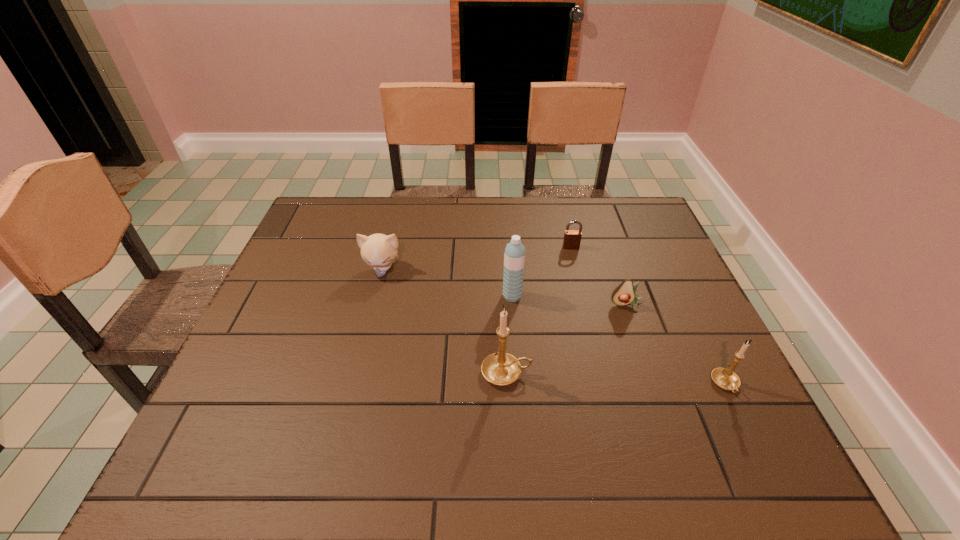
Where is `the taller candle holder`? Image resolution: width=960 pixels, height=540 pixels. the taller candle holder is located at coordinates (500, 368).

You are a GUI agent. You are given a task and a screenshot of the screen. Output one action in this format:
    pyautogui.click(x=<x>, y=<y>)
    Task: Click on the rightmost object
    This screenshot has height=540, width=960.
    Given the screenshot: What is the action you would take?
    pyautogui.click(x=725, y=378)

In order to click on the right candle holder in this screenshot , I will do `click(725, 378)`.

Locate an element on the screen. The height and width of the screenshot is (540, 960). the second farthest object is located at coordinates 378,250.

The width and height of the screenshot is (960, 540). Find the location of `kitten`. kitten is located at coordinates (378, 250).

Identify the location of padlock. coord(572,238).

In order to click on the third object from right to left in this screenshot , I will do `click(572, 238)`.

The image size is (960, 540). Identify the location of the second object from right to left. (624, 294).

Identify the location of water bottle. This screenshot has height=540, width=960. (514, 256).

Where is `free space located 0.170m on the handle side of the left candle holder`? The height and width of the screenshot is (540, 960). free space located 0.170m on the handle side of the left candle holder is located at coordinates (608, 373).